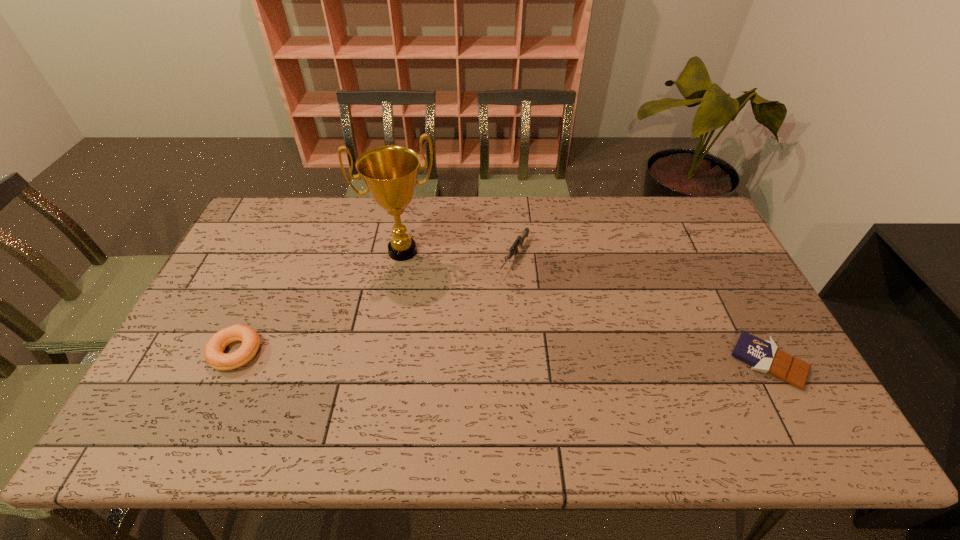
Identify the location of vacant space on the desktop that is between the bagel and the rightmost object and is positioned aimed along the barrel of the second tallest object. (448, 356).

Identify the location of vacant spot on the desktop that is between the bagel and the shortest object and is positioned on the front view with handles of the award. (432, 356).